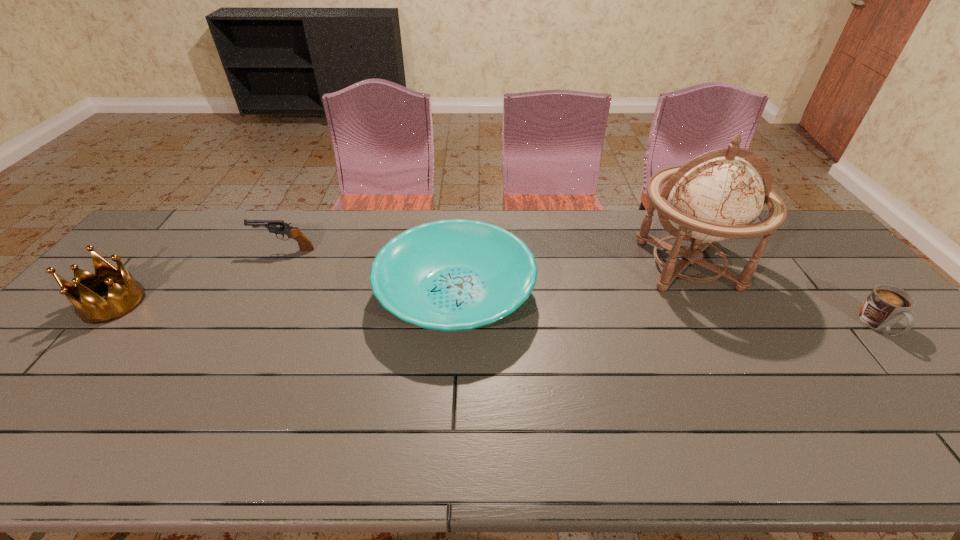
Identify the location of globe. The image size is (960, 540). (716, 196).

Locate an element on the screen. This screenshot has height=540, width=960. the second object from right to left is located at coordinates (716, 196).

Identify the location of crown. The image size is (960, 540). (89, 306).

This screenshot has width=960, height=540. Identify the location of the leftmost object. (89, 306).

In order to click on gun in this screenshot , I will do `click(274, 226)`.

You are a GUI agent. You are given a task and a screenshot of the screen. Output one action in this format:
    pyautogui.click(x=<x>, y=<y>)
    Task: Click on the third object from right to left
    
    Given the screenshot: What is the action you would take?
    pyautogui.click(x=449, y=275)

Image resolution: width=960 pixels, height=540 pixels. Find the location of `mug`. mug is located at coordinates (886, 305).

You are a GUI agent. You are given a task and a screenshot of the screen. Output one action in this format:
    pyautogui.click(x=<x>, y=<y>)
    Task: Click on the vacant space located at the front of the globe showing Africa
    
    Given the screenshot: What is the action you would take?
    pyautogui.click(x=764, y=408)

I want to click on vacant space located on the front of the crown, so click(77, 345).

You are a GUI agent. You are given a task and a screenshot of the screen. Output one action in this format:
    pyautogui.click(x=<x>, y=<y>)
    Task: Click on the vacant region located along the barrel of the fourth object from right to left
    The height and width of the screenshot is (540, 960).
    Given the screenshot: What is the action you would take?
    pyautogui.click(x=137, y=250)